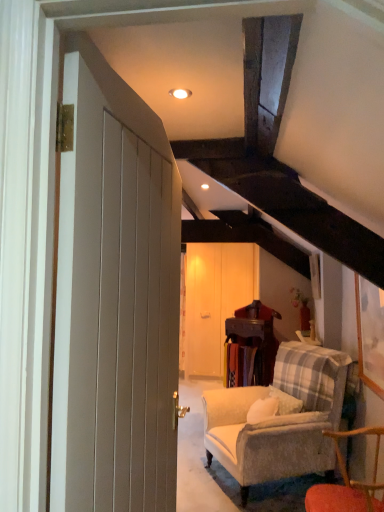
Question: Looking at their shapes, would you say wooden table at center is wider or thinner than wooden chair at lower right?

Choices:
 (A) thin
 (B) wide

Answer: (A)

Question: Does point (249, 328) appear closer or farther from the camera than point (382, 509)?

Choices:
 (A) farther
 (B) closer

Answer: (A)

Question: Estimate the real-world distances between objects in this image. Which object is closer to the plush beige couch at center?

Choices:
 (A) matte white door at left
 (B) wooden chair at lower right
 (C) wooden table at center
 (D) wooden barn door at center

Answer: (C)

Question: Which object is the farthest from the wooden table at center?

Choices:
 (A) wooden chair at lower right
 (B) wooden barn door at center
 (C) matte white door at left
 (D) plush beige couch at center

Answer: (C)